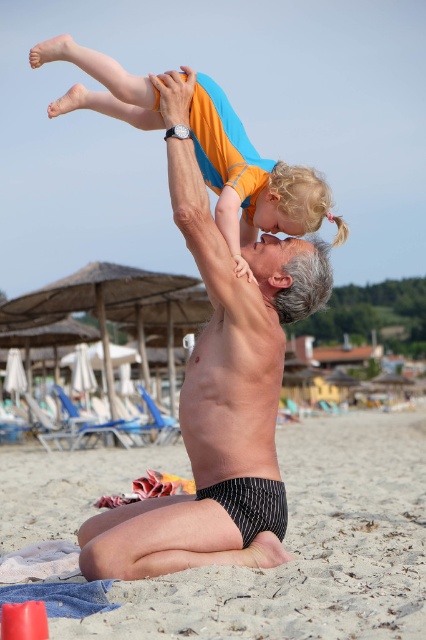
Between smooth beige sand at lower center and smooth skin man at center, which one has less height?

smooth beige sand at lower center

Is point (299, 563) less distant than point (183, 163)?

No.

Measure the distance between smooth beige sand at lower center and camera.

The distance of smooth beige sand at lower center from camera is 3.81 meters.

At what (x,y) coordinates should I click in order to perform the action: click on smooth beige sand at lower center. Please return your answer as a coordinate pair (x, y). This screenshot has height=640, width=426. Looking at the image, I should click on (307, 548).

How distant is smooth beige sand at lower center from orange cotton shirt at upper center?

The distance of smooth beige sand at lower center from orange cotton shirt at upper center is 6.33 meters.

Does smooth beige sand at lower center have a greater height compared to orange cotton shirt at upper center?

Yes.

Between point (365, 486) and point (31, 67), which one is positioned behind?

Point (365, 486)

Where is `smooth beige sand at lower center`? The image size is (426, 640). smooth beige sand at lower center is located at coordinates (307, 548).

Is point (227, 458) positioned before point (32, 51)?

Yes, it is in front of point (32, 51).

Is point (232, 529) positioned in front of point (124, 99)?

Yes, it is in front of point (124, 99).

What are the coordinates of `smooth skin man at center` in the screenshot? It's located at (218, 401).